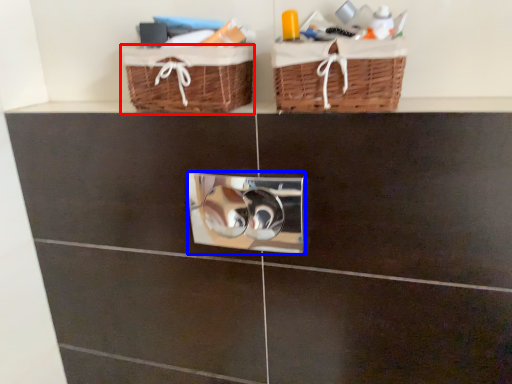
Question: Which object is closer to the camera taking this photo, basket (highlighted by a red box) or lock (highlighted by a blue box)?

Choices:
 (A) basket
 (B) lock

Answer: (A)